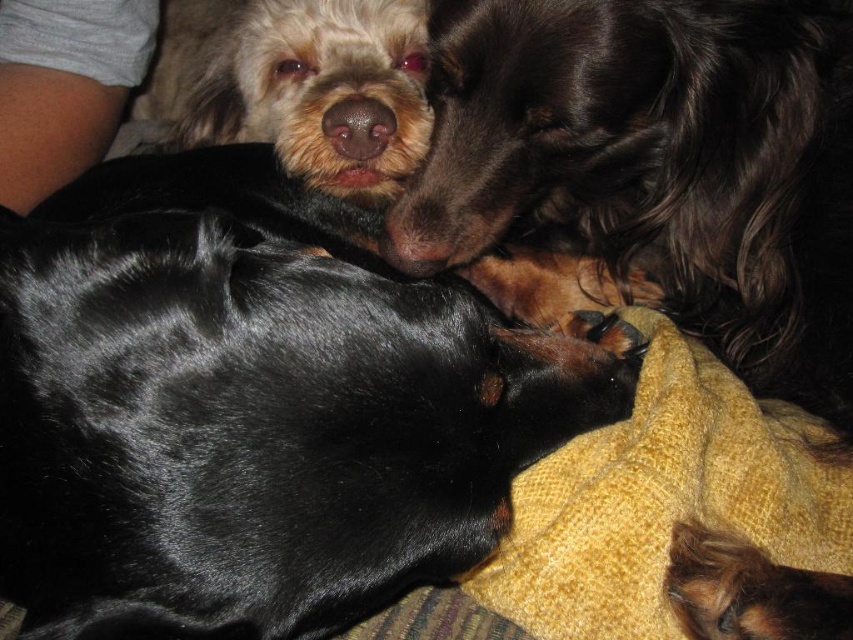
You are standing at the origin point in the image and want to throw a treat to the dog located at point (515, 595). However, there is another dog at point (706, 330). Based on their positions, will the treat reach the intended dog without being intercepted by the other dog?

Point (706, 330) is behind point (515, 595), so the treat will reach the intended dog at point (515, 595) without being intercepted by the other dog at point (706, 330).

You are a photographer trying to capture a close shot of both the shiny black coat at upper center and the shaggy white fur at upper left. Based on their positions, can you tell which one is closer to the camera?

The shiny black coat at upper center is closer to the camera than the shaggy white fur at upper left because it is positioned below it.

You are trying to place a new toy between the shiny brown fur at upper center and the yellow textured blanket at lower right. Which object should you place the toy closer to if the toy is 1 meter wide?

The shiny brown fur at upper center is wider than the yellow textured blanket at lower right. Therefore, the toy should be placed closer to the shiny brown fur at upper center to ensure it fits within the available space.